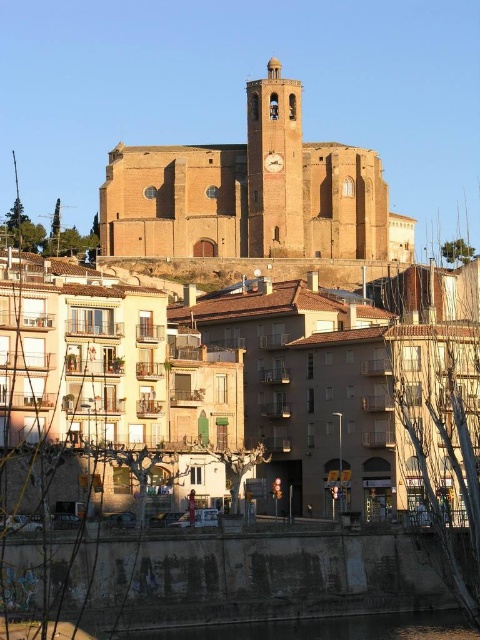
You are a tourist standing at the base of the hill where the smooth stone clock tower at center and the black concrete river at lower center are visible. You want to take a photo that includes both objects in the frame. Which object should you focus on to ensure both are in the frame?

You should focus on the smooth stone clock tower at center because it is larger than the black concrete river at lower center, so positioning the camera to include the larger object will naturally include the smaller one in the frame.

Looking at this image, you are a tourist standing at the base of the hill looking towards the church. You notice the smooth stone clock tower at center and the black concrete river at lower center. Which object is closer to you?

The smooth stone clock tower at center is closer to you since the black concrete river at lower center is behind it.